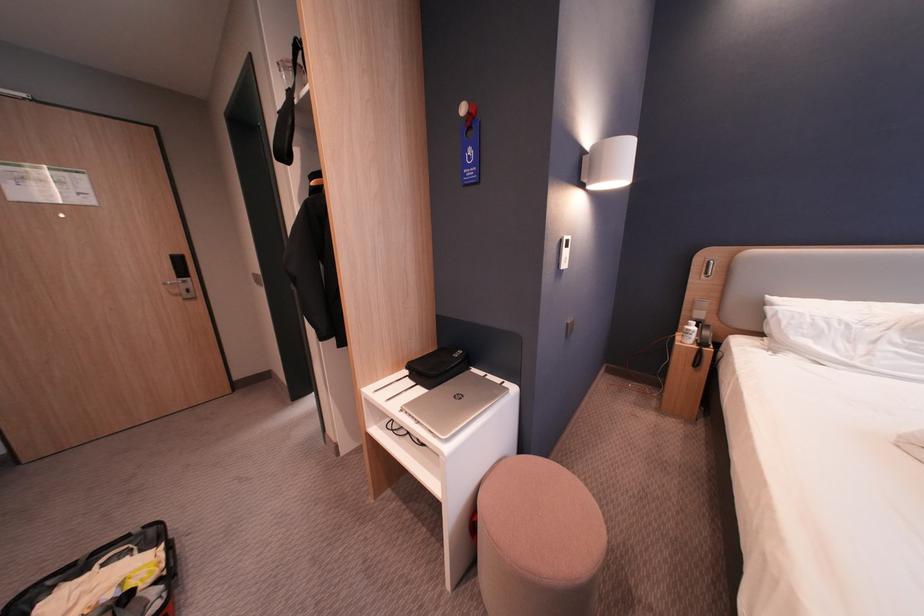
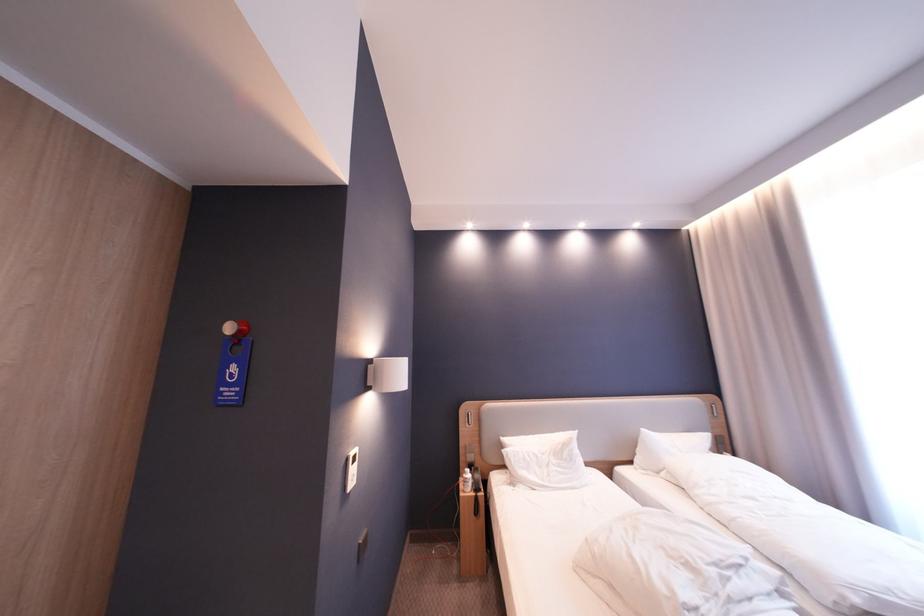
Find the pixel in the second image that matches (x=865, y=326) in the first image.

(550, 456)